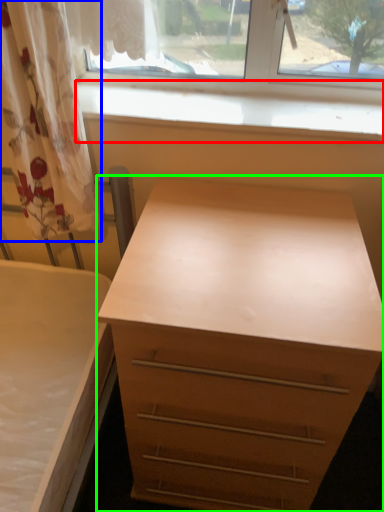
Question: Which object is positioned closest to window sill (highlighted by a red box)? Select from curtain (highlighted by a blue box) and chest of drawers (highlighted by a green box).

Choices:
 (A) curtain
 (B) chest of drawers

Answer: (A)